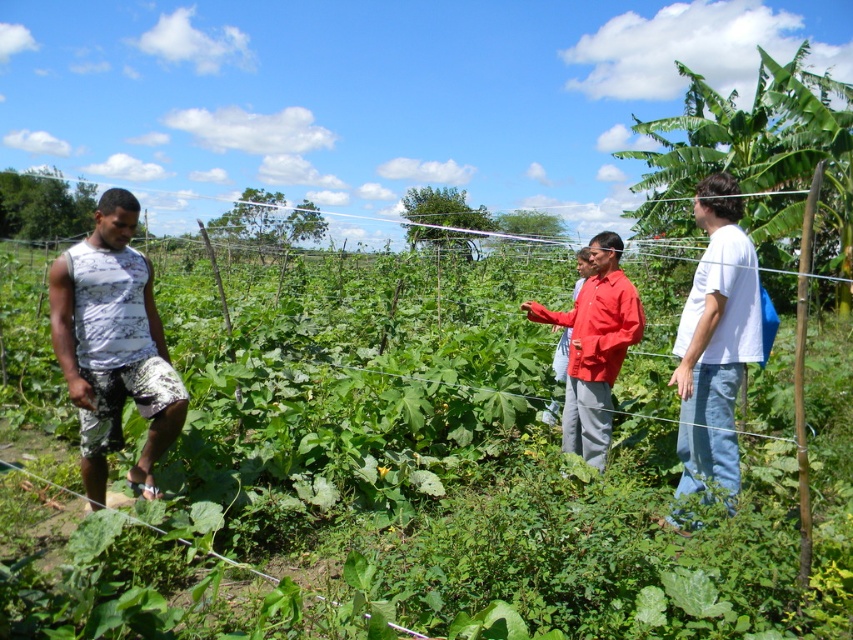
Does white printed tank top at left have a lesser height compared to matte red shirt at center?

Yes.

In order to click on white printed tank top at left in this screenshot , I will do `click(113, 346)`.

Where is `white printed tank top at left`? The height and width of the screenshot is (640, 853). white printed tank top at left is located at coordinates (113, 346).

Does white printed tank top at left appear on the right side of white cotton shirt at right?

No, white printed tank top at left is not to the right of white cotton shirt at right.

Is white printed tank top at left to the left of white cotton shirt at right from the viewer's perspective?

Indeed, white printed tank top at left is positioned on the left side of white cotton shirt at right.

The height and width of the screenshot is (640, 853). What are the coordinates of `white printed tank top at left` in the screenshot? It's located at (113, 346).

Image resolution: width=853 pixels, height=640 pixels. I want to click on white printed tank top at left, so click(x=113, y=346).

Who is lower down, white printed tank top at left or red matte shirt at center?

white printed tank top at left is lower down.

Image resolution: width=853 pixels, height=640 pixels. Identify the location of white printed tank top at left. (113, 346).